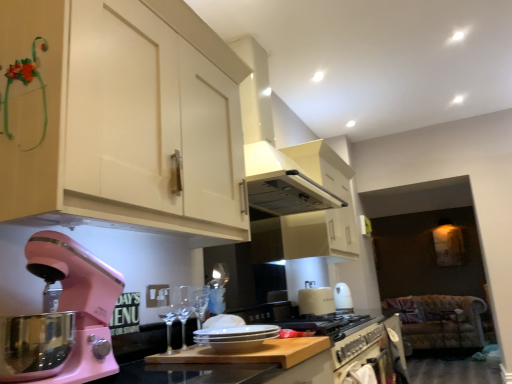
Question: Considering the relative sizes of white glossy plates at center and clear glass wine glass at center, positioned as the first wine glass in front-to-back order, in the image provided, is white glossy plates at center taller than clear glass wine glass at center, positioned as the first wine glass in front-to-back order,?

Choices:
 (A) yes
 (B) no

Answer: (B)

Question: Is white glossy plates at center positioned beyond the bounds of clear glass wine glass at center, positioned as the first wine glass in front-to-back order?

Choices:
 (A) no
 (B) yes

Answer: (B)

Question: Are white glossy plates at center and clear glass wine glass at center, positioned as the first wine glass in front-to-back order, beside each other?

Choices:
 (A) no
 (B) yes

Answer: (A)

Question: Can you confirm if white glossy plates at center is wider than clear glass wine glass at center, which is the second wine glass in back-to-front order?

Choices:
 (A) no
 (B) yes

Answer: (B)

Question: Does white glossy plates at center have a lesser width compared to clear glass wine glass at center, which is the second wine glass in back-to-front order?

Choices:
 (A) yes
 (B) no

Answer: (B)

Question: Considering the relative positions of white glossy plates at center and clear glass wine glass at center, which is the second wine glass in back-to-front order, in the image provided, is white glossy plates at center behind clear glass wine glass at center, which is the second wine glass in back-to-front order,?

Choices:
 (A) no
 (B) yes

Answer: (A)

Question: Is clear glass wine glass at center, marked as the 1th wine glass in a back-to-front arrangement, outside white glossy exhaust hood at upper center?

Choices:
 (A) no
 (B) yes

Answer: (B)

Question: Is clear glass wine glass at center, marked as the 1th wine glass in a back-to-front arrangement, to the right of white glossy exhaust hood at upper center from the viewer's perspective?

Choices:
 (A) yes
 (B) no

Answer: (B)

Question: Is white glossy exhaust hood at upper center a part of clear glass wine glass at center, marked as the 1th wine glass in a back-to-front arrangement?

Choices:
 (A) no
 (B) yes

Answer: (A)

Question: From the image's perspective, is clear glass wine glass at center, marked as the 1th wine glass in a back-to-front arrangement, on top of white glossy exhaust hood at upper center?

Choices:
 (A) yes
 (B) no

Answer: (B)

Question: Can you confirm if clear glass wine glass at center, which ranks as the second wine glass in front-to-back order, is bigger than white glossy exhaust hood at upper center?

Choices:
 (A) yes
 (B) no

Answer: (B)

Question: Is the surface of clear glass wine glass at center, marked as the 1th wine glass in a back-to-front arrangement, in direct contact with white glossy exhaust hood at upper center?

Choices:
 (A) yes
 (B) no

Answer: (B)

Question: From a real-world perspective, is smooth wooden cutting board at center below clear glass wine glass at center, which is the second wine glass in back-to-front order?

Choices:
 (A) no
 (B) yes

Answer: (B)